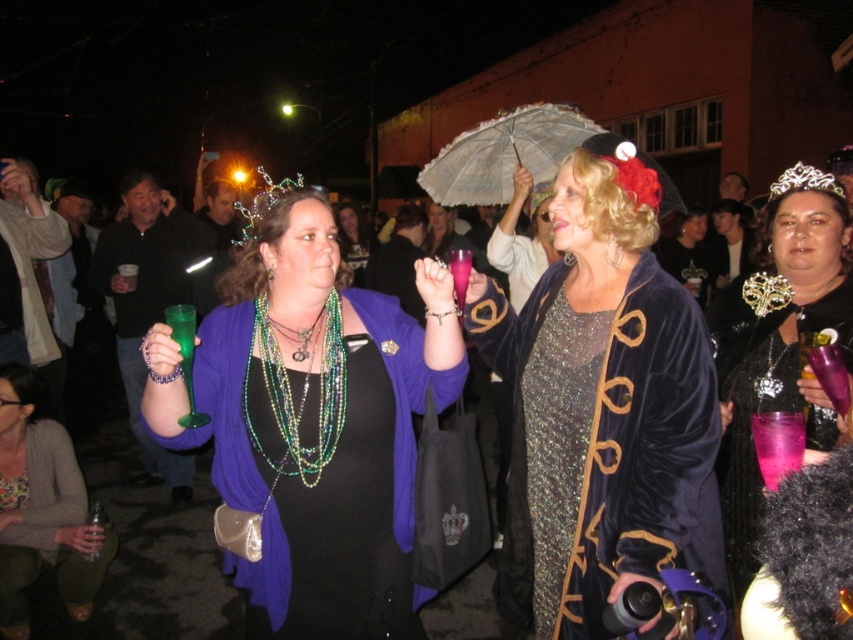
You are a photographer at the event and want to capture both the shiny black dress at center and the matte black dress at center in the same frame. Which dress should you focus on first to ensure both are in focus?

The shiny black dress at center is positioned over the matte black dress at center, so focusing on the shiny black dress at center first will ensure both are in focus as the matte one is behind it.

You are at a festival and want to take a photo of the matte black dress at center and the gold metallic tiara at upper right. Which object should you focus on first to ensure both are in the frame?

You should focus on the matte black dress at center first because it is closer to you than the gold metallic tiara at upper right, so adjusting the camera to capture it ensures the tiara will also be in the frame.